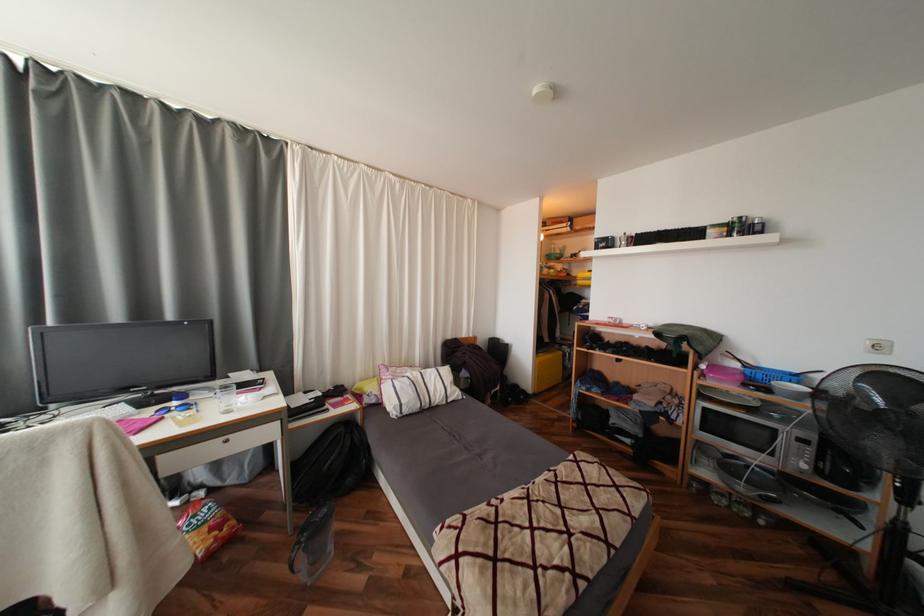
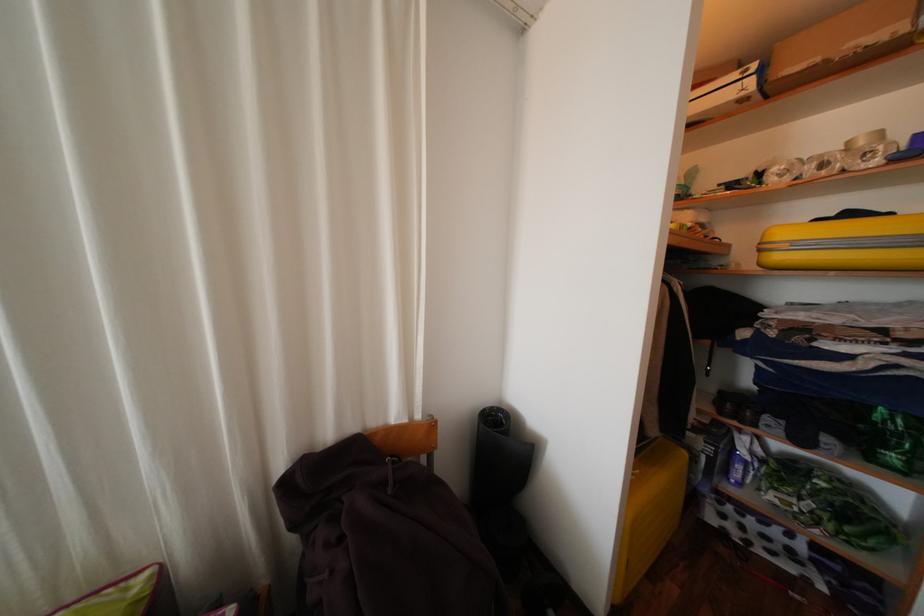
Question: The images are taken continuously from a first-person perspective. In which direction are you moving?

Choices:
 (A) Left
 (B) Right
 (C) Forward
 (D) Backward

Answer: (C)